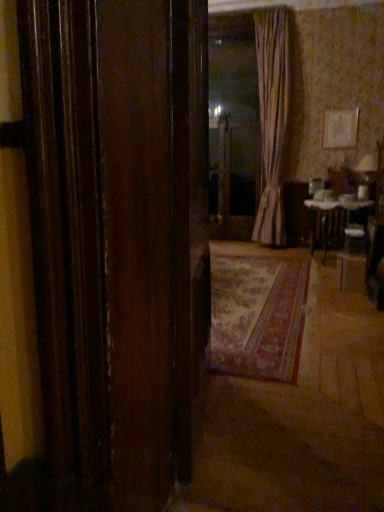
Question: From the image's perspective, is transparent glass door at center above white glossy table at center?

Choices:
 (A) no
 (B) yes

Answer: (B)

Question: Is transparent glass door at center taller than white glossy table at center?

Choices:
 (A) no
 (B) yes

Answer: (B)

Question: Could white glossy table at center be considered to be inside transparent glass door at center?

Choices:
 (A) no
 (B) yes

Answer: (A)

Question: Would you consider transparent glass door at center to be distant from white glossy table at center?

Choices:
 (A) yes
 (B) no

Answer: (A)

Question: From a real-world perspective, is transparent glass door at center beneath white glossy table at center?

Choices:
 (A) no
 (B) yes

Answer: (A)

Question: Is transparent glass door at center to the right of white glossy table at center from the viewer's perspective?

Choices:
 (A) no
 (B) yes

Answer: (A)

Question: Considering the relative sizes of transparent glass door at center and striped fabric curtain at center in the image provided, is transparent glass door at center wider than striped fabric curtain at center?

Choices:
 (A) no
 (B) yes

Answer: (A)

Question: Is transparent glass door at center further to the viewer compared to striped fabric curtain at center?

Choices:
 (A) no
 (B) yes

Answer: (B)

Question: Is transparent glass door at center aimed at striped fabric curtain at center?

Choices:
 (A) yes
 (B) no

Answer: (B)

Question: Is the position of transparent glass door at center less distant than that of striped fabric curtain at center?

Choices:
 (A) no
 (B) yes

Answer: (A)

Question: Is transparent glass door at center not within striped fabric curtain at center?

Choices:
 (A) no
 (B) yes

Answer: (B)

Question: From the image's perspective, is transparent glass door at center below striped fabric curtain at center?

Choices:
 (A) yes
 (B) no

Answer: (A)

Question: From a real-world perspective, is wooden door at center below transparent glass door at center?

Choices:
 (A) yes
 (B) no

Answer: (A)